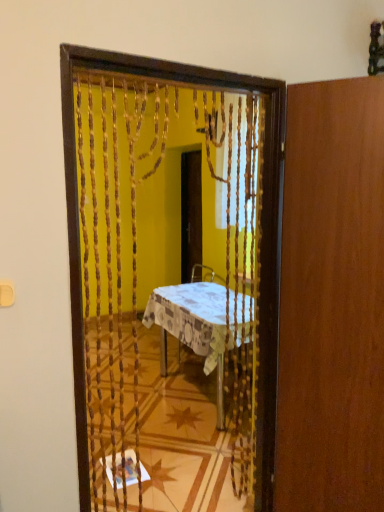
Question: Is wooden door at right at the right side of wooden screen door at center?

Choices:
 (A) yes
 (B) no

Answer: (A)

Question: Is wooden door at right positioned behind wooden screen door at center?

Choices:
 (A) no
 (B) yes

Answer: (A)

Question: Is wooden door at right oriented towards wooden screen door at center?

Choices:
 (A) no
 (B) yes

Answer: (A)

Question: Can you confirm if wooden door at right is positioned to the left of wooden screen door at center?

Choices:
 (A) no
 (B) yes

Answer: (A)

Question: Does wooden door at right lie in front of wooden screen door at center?

Choices:
 (A) no
 (B) yes

Answer: (B)

Question: Does wooden door at right have a lesser width compared to wooden screen door at center?

Choices:
 (A) yes
 (B) no

Answer: (B)

Question: From the image's perspective, is patterned fabric table at center above wooden door at right?

Choices:
 (A) yes
 (B) no

Answer: (B)

Question: Is patterned fabric table at center thinner than wooden door at right?

Choices:
 (A) no
 (B) yes

Answer: (A)

Question: From a real-world perspective, is patterned fabric table at center on top of wooden door at right?

Choices:
 (A) no
 (B) yes

Answer: (A)

Question: Considering the relative sizes of patterned fabric table at center and wooden door at right in the image provided, is patterned fabric table at center shorter than wooden door at right?

Choices:
 (A) no
 (B) yes

Answer: (B)

Question: From the image's perspective, is patterned fabric table at center below wooden door at right?

Choices:
 (A) no
 (B) yes

Answer: (B)

Question: Does patterned fabric table at center have a greater width compared to wooden door at right?

Choices:
 (A) yes
 (B) no

Answer: (A)

Question: Is patterned fabric table at center oriented towards wooden screen door at center?

Choices:
 (A) no
 (B) yes

Answer: (A)